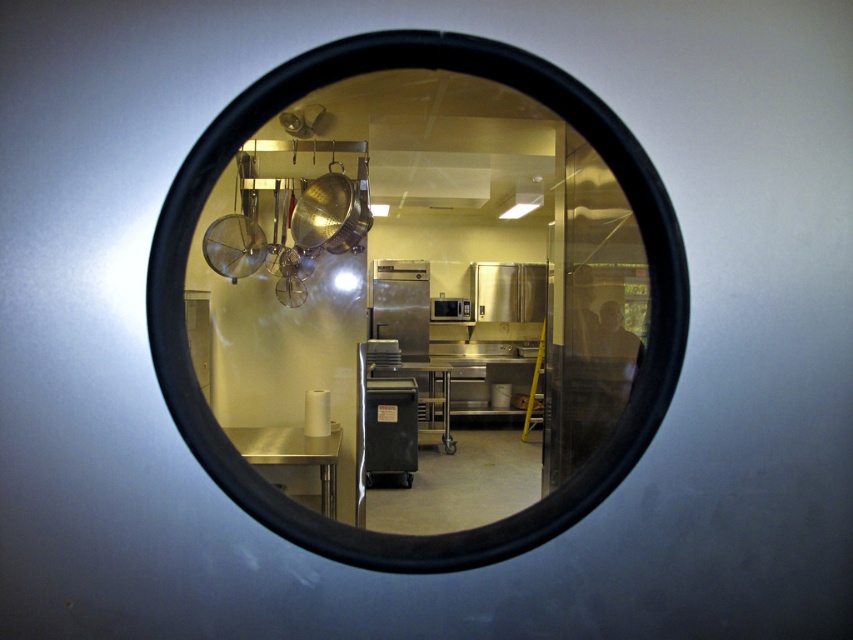
You are a delivery person trying to locate the microwave in the commercial kitchen through the peephole. According to the view, which direction should you move relative to the stainless steel appliance at center to find the satin silver microwave at center?

The satin silver microwave at center is to the right of the stainless steel appliance at center. Therefore, you should move to the right relative to the stainless steel appliance at center to locate the satin silver microwave at center.

You are looking through a circular window into a commercial kitchen. You see a yellow handled ladder and some hanging utensils. There is also a point marked at coordinates (428, 292). What object is located at that point?

The point at (428, 292) marks the location of the stainless steel pots at upper center.

You are a delivery person trying to determine if there is enough space to place a large box in the center of the kitchen. You see the stainless steel pots at upper center and the black plastic cart at center. Which object takes up more space in the kitchen?

The black plastic cart at center takes up more space than the stainless steel pots at upper center.